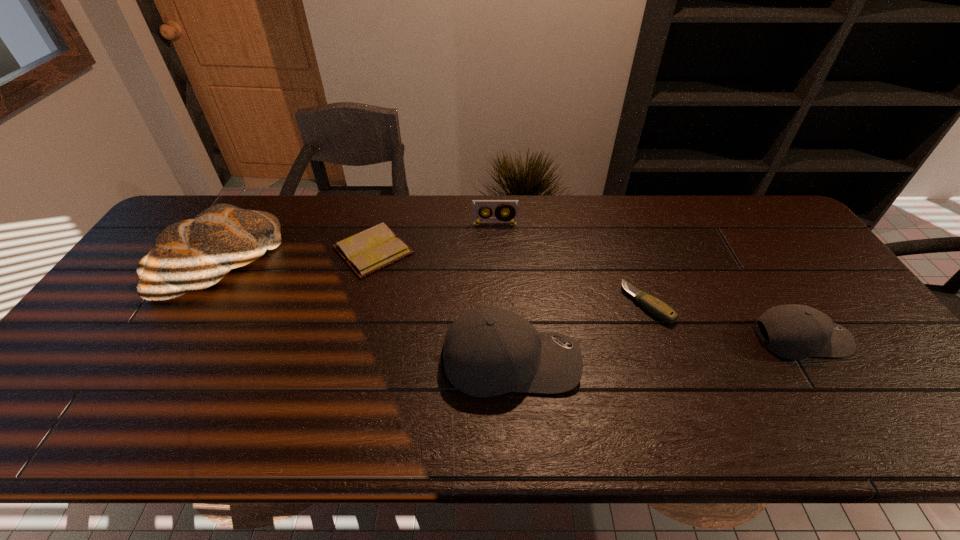
The width and height of the screenshot is (960, 540). I want to click on the taller baseball cap, so click(x=487, y=352).

I want to click on the right baseball cap, so click(795, 332).

Image resolution: width=960 pixels, height=540 pixels. I want to click on the rightmost object, so click(795, 332).

Identify the location of videotape. (498, 217).

Identify the location of the second shortest object. The height and width of the screenshot is (540, 960). (658, 308).

Locate an element on the screen. Image resolution: width=960 pixels, height=540 pixels. pocketknife is located at coordinates (658, 308).

I want to click on bread, so click(x=194, y=254).

The height and width of the screenshot is (540, 960). What are the coordinates of `the shortest object` in the screenshot? It's located at (377, 247).

I want to click on diary, so click(x=377, y=247).

Find the location of a particular element. vacant space located on the front brim of the taller baseball cap is located at coordinates (654, 361).